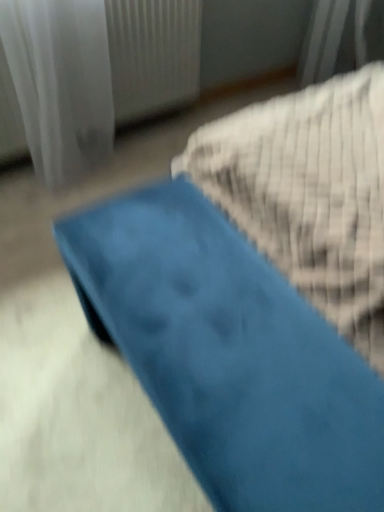
Question: Considering the relative sizes of blue fabric ottoman at center and white sheer curtain at upper left in the image provided, is blue fabric ottoman at center wider than white sheer curtain at upper left?

Choices:
 (A) no
 (B) yes

Answer: (B)

Question: From the image's perspective, would you say blue fabric ottoman at center is shown under white sheer curtain at upper left?

Choices:
 (A) no
 (B) yes

Answer: (B)

Question: Considering the relative sizes of blue fabric ottoman at center and white sheer curtain at upper left in the image provided, is blue fabric ottoman at center thinner than white sheer curtain at upper left?

Choices:
 (A) no
 (B) yes

Answer: (A)

Question: Is blue fabric ottoman at center shorter than white sheer curtain at upper left?

Choices:
 (A) yes
 (B) no

Answer: (A)

Question: Is blue fabric ottoman at center in front of white sheer curtain at upper left?

Choices:
 (A) no
 (B) yes

Answer: (B)

Question: Is blue fabric ottoman at center not within white sheer curtain at upper left?

Choices:
 (A) yes
 (B) no

Answer: (A)

Question: Could you tell me if white sheer curtain at upper left is facing blue fabric ottoman at center?

Choices:
 (A) yes
 (B) no

Answer: (A)

Question: Considering the relative sizes of white sheer curtain at upper left and blue fabric ottoman at center in the image provided, is white sheer curtain at upper left thinner than blue fabric ottoman at center?

Choices:
 (A) yes
 (B) no

Answer: (A)

Question: Does white sheer curtain at upper left have a greater height compared to blue fabric ottoman at center?

Choices:
 (A) no
 (B) yes

Answer: (B)

Question: Does white sheer curtain at upper left have a lesser height compared to blue fabric ottoman at center?

Choices:
 (A) yes
 (B) no

Answer: (B)

Question: From the image's perspective, is white sheer curtain at upper left beneath blue fabric ottoman at center?

Choices:
 (A) no
 (B) yes

Answer: (A)

Question: Does white sheer curtain at upper left come in front of blue fabric ottoman at center?

Choices:
 (A) no
 (B) yes

Answer: (A)

Question: From a real-world perspective, is white sheer curtain at upper left above or below blue fabric ottoman at center?

Choices:
 (A) below
 (B) above

Answer: (B)